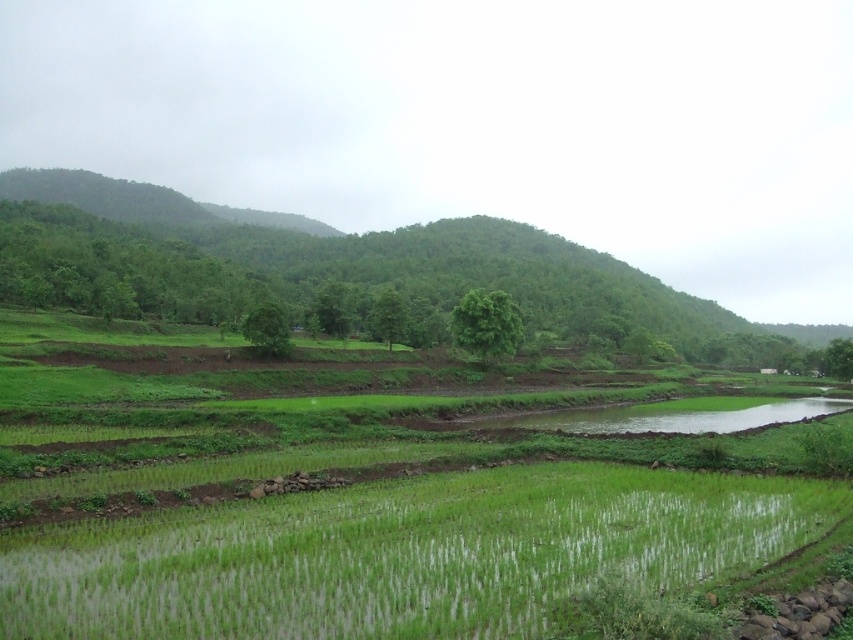
You are a farmer planning to plant crops in the green grassy rice field at lower center and the green leafy hillside at center. Which area has more space available for planting?

The green leafy hillside at center has more space available for planting since it is larger than the green grassy rice field at lower center.

You are a farmer planning to plant new crops. You have two areas available for planting. One is the green grassy rice field at lower center and the other is the green leafy hillside at center. Which area has a narrower width for planting?

The green grassy rice field at lower center is thinner than the green leafy hillside at center, so the green grassy rice field at lower center has a narrower width for planting.